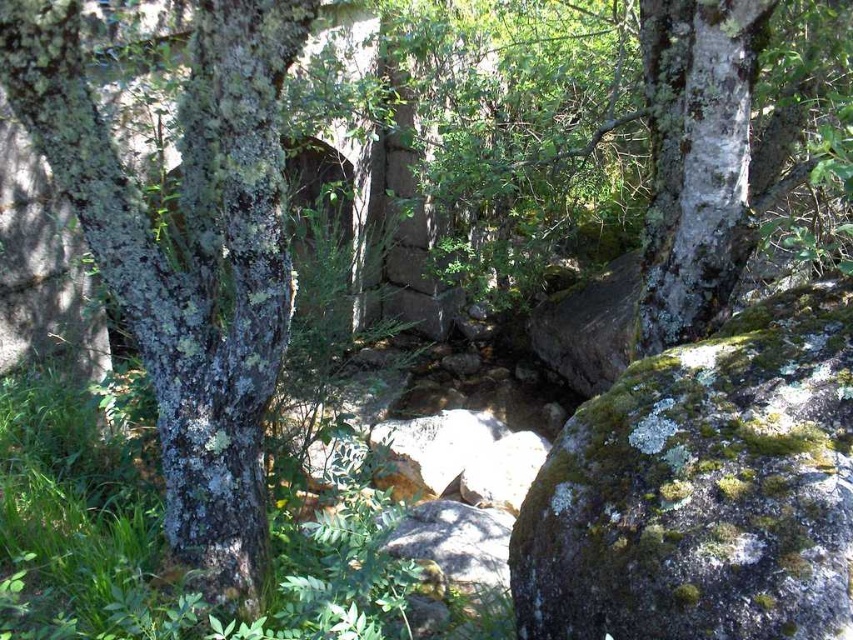
You are a hiker trying to cross the stream in the middle ground. You see the green mossy rock at center and the speckled bark tree at center. Which object should you avoid stepping on to ensure a stable footing?

You should avoid stepping on the green mossy rock at center because it is positioned on the right side of the speckled bark tree at center, which means it might be in the middle of the stream where the water flows more strongly, making it slippery and unstable.